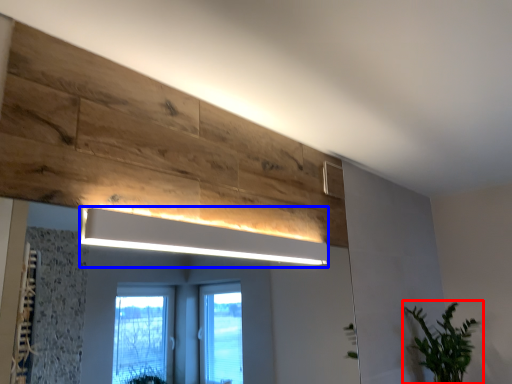
Question: Which of the following is the closest to the observer, houseplant (highlighted by a red box) or light fixture (highlighted by a blue box)?

Choices:
 (A) houseplant
 (B) light fixture

Answer: (B)